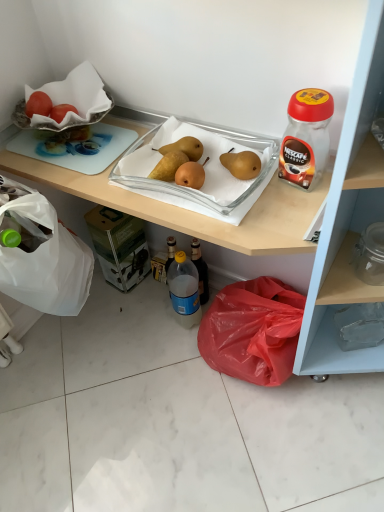
The image size is (384, 512). Find the location of `vacant space to the left of blue translucent bottle at center, which is the first bottle from bottom to top`. vacant space to the left of blue translucent bottle at center, which is the first bottle from bottom to top is located at coordinates (140, 327).